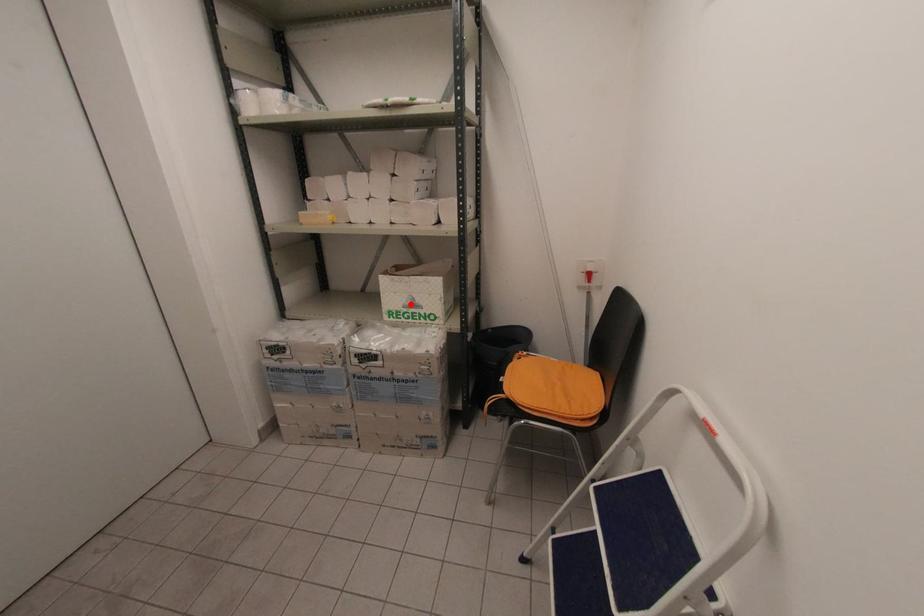
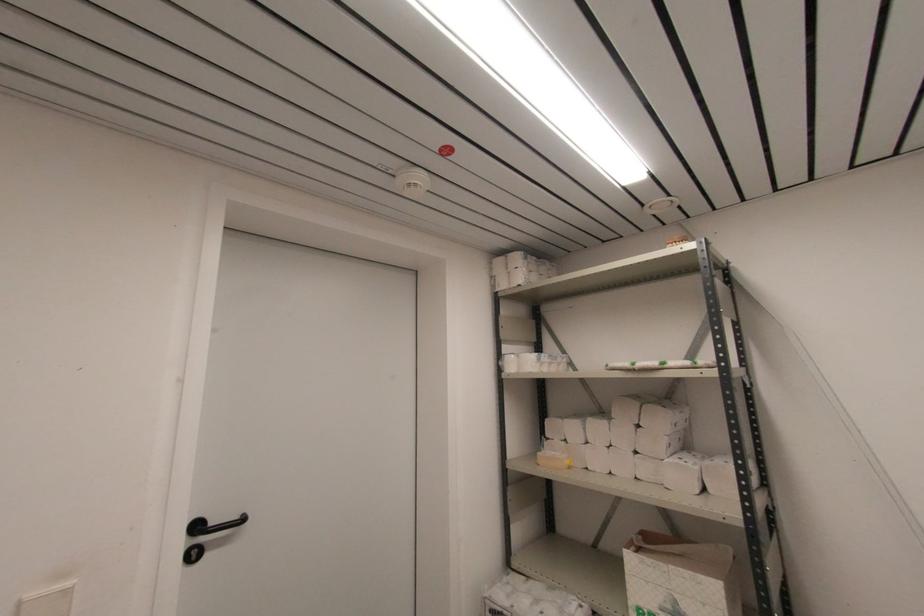
Locate, in the second image, the point that corresponds to the highlighted location in the first image.

(671, 609)